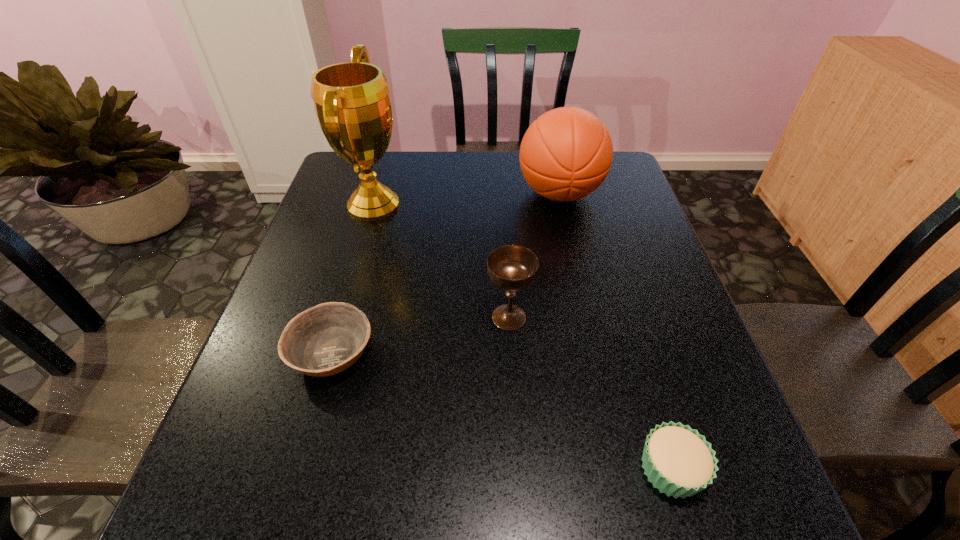
You are a GUI agent. You are given a task and a screenshot of the screen. Output one action in this format:
    pyautogui.click(x=<x>, y=<y>)
    Task: Click on the vacant region that satisfies the following two spatial constraints: 1. on the back side of the bowl; 2. on the right side of the chalice
    This screenshot has height=540, width=960.
    Given the screenshot: What is the action you would take?
    pyautogui.click(x=343, y=317)

Find the location of a particular element. This screenshot has height=540, width=960. free spot that satisfies the following two spatial constraints: 1. on the front-facing side of the tallest object; 2. on the right side of the cupcake is located at coordinates [298, 468].

You are a GUI agent. You are given a task and a screenshot of the screen. Output one action in this format:
    pyautogui.click(x=<x>, y=<y>)
    Task: Click on the vacant point that satisfies the following two spatial constraints: 1. on the front-facing side of the award; 2. on the back side of the bowl
    
    Given the screenshot: What is the action you would take?
    pyautogui.click(x=331, y=353)

Where is `free space that satisfies the following two spatial constraints: 1. on the front-facing side of the tallest object; 2. on the right side of the third tallest object`? The height and width of the screenshot is (540, 960). free space that satisfies the following two spatial constraints: 1. on the front-facing side of the tallest object; 2. on the right side of the third tallest object is located at coordinates (342, 317).

Identify the location of free point that satisfies the following two spatial constraints: 1. on the front-facing side of the chalice; 2. on the left side of the award. (342, 317).